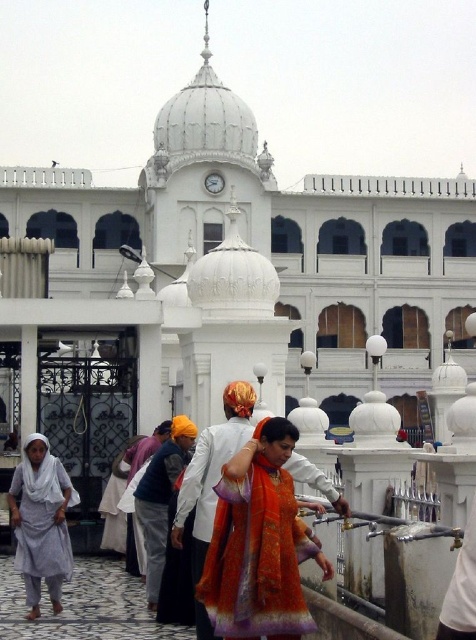
Question: Is orange silk saree at center behind light gray cotton dress at lower left?

Choices:
 (A) no
 (B) yes

Answer: (A)

Question: Which object is the closest to the light gray cotton dress at lower left?

Choices:
 (A) orange silk saree at center
 (B) orange silk robe at center

Answer: (B)

Question: Does orange silk saree at center come behind light gray cotton dress at lower left?

Choices:
 (A) no
 (B) yes

Answer: (A)

Question: Which is farther from the light gray cotton dress at lower left?

Choices:
 (A) orange silk saree at center
 (B) orange silk robe at center

Answer: (A)

Question: Is orange silk saree at center wider than orange silk robe at center?

Choices:
 (A) no
 (B) yes

Answer: (B)

Question: Which point is farther from the camera taking this photo?

Choices:
 (A) (152, 481)
 (B) (268, 428)

Answer: (A)